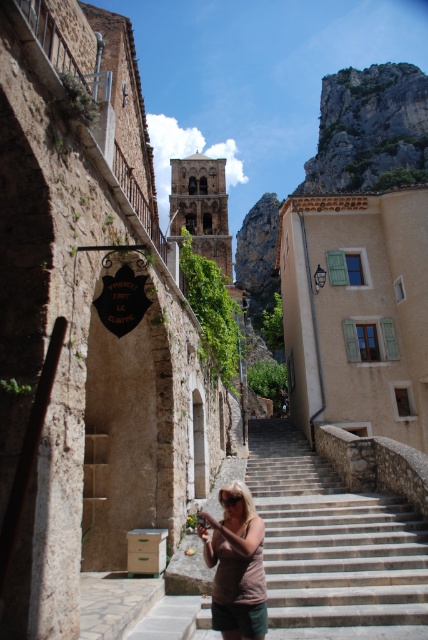
How much distance is there between smooth stone stairs at center and brown cotton shirt at center?

smooth stone stairs at center is 5.11 meters away from brown cotton shirt at center.

Is point (323, 518) positioned behind point (228, 550)?

Yes, point (323, 518) is behind point (228, 550).

Between point (299, 529) and point (246, 490), which one is positioned behind?

Point (299, 529)

You are a GUI agent. You are given a task and a screenshot of the screen. Output one action in this format:
    pyautogui.click(x=<x>, y=<y>)
    Task: Click on the smooth stone stairs at center
    Image resolution: width=428 pixels, height=640 pixels.
    Given the screenshot: What is the action you would take?
    tap(332, 541)